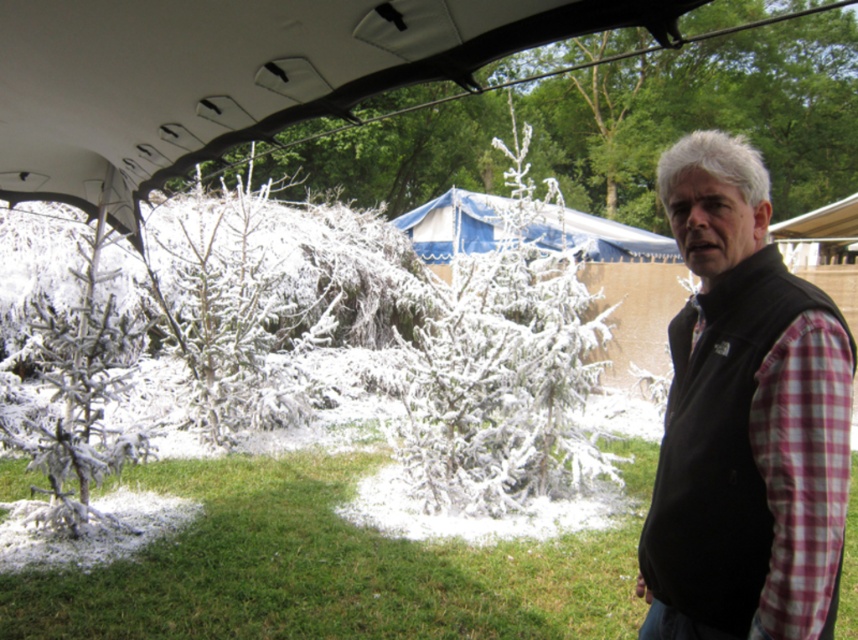
You are a photographer trying to capture the white frosty branches at center and the white frosty branches at left in a single frame. Which of the two branches should you focus on first if you want to ensure both are in focus?

The white frosty branches at center is shorter than the white frosty branches at left, so you should focus on the white frosty branches at left first to ensure both are in focus.

You are planning to place a 10 feet long bench between the white frosty branches at center and the white frosty branches at left. Can you fit the bench between them?

The distance between the white frosty branches at center and the white frosty branches at left is 11.88 feet, so the 10 feet long bench can fit between them since it is shorter than the available space.